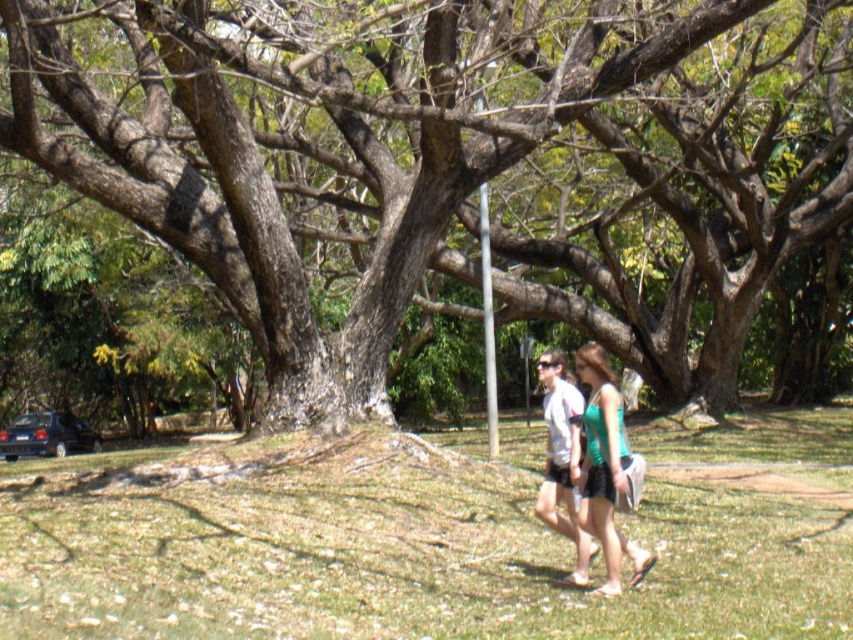
You are standing in the park and want to take a photo of both the green grass at center and the brown rough tree at center. Which object should you focus on first to ensure both are in the frame?

You should focus on the green grass at center first because it is in front of the brown rough tree at center, so positioning yourself to include the grass will naturally include the tree in the background.

You are standing at the origin point of the image. Which direction should you move to reach the green grass at center?

You should move towards the coordinates point at (445, 547) to reach the green grass at center.